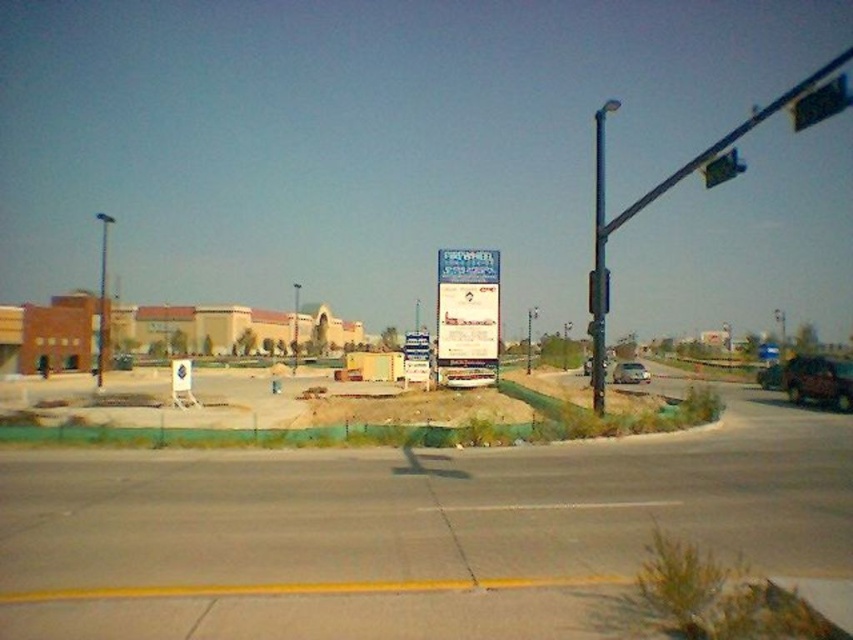
You are driving a car and see the metallic pole at left and the silver metallic sedan at center. Which one is closer to the left side of the road?

The metallic pole at left is closer to the left side of the road since it is positioned to the left of the silver metallic sedan at center.